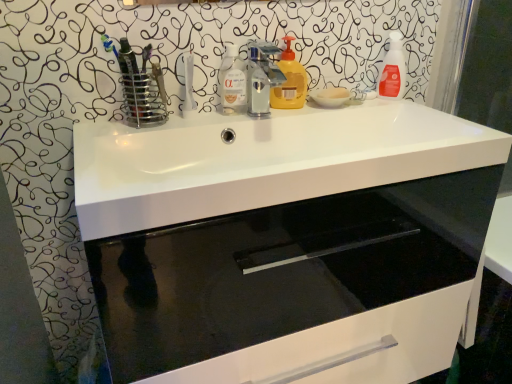
Question: Is white glossy sink at center wider than translucent orange spray bottle at upper right, acting as the 3th cleaning product starting from the left?

Choices:
 (A) yes
 (B) no

Answer: (A)

Question: Does white glossy sink at center contain translucent orange spray bottle at upper right, acting as the 3th cleaning product starting from the left?

Choices:
 (A) no
 (B) yes

Answer: (A)

Question: From the image's perspective, does white glossy sink at center appear higher than translucent orange spray bottle at upper right, acting as the 3th cleaning product starting from the left?

Choices:
 (A) yes
 (B) no

Answer: (B)

Question: Could you tell me if white glossy sink at center is turned towards translucent orange spray bottle at upper right, which is counted as the first cleaning product, starting from the right?

Choices:
 (A) no
 (B) yes

Answer: (A)

Question: Is white glossy sink at center thinner than translucent orange spray bottle at upper right, acting as the 3th cleaning product starting from the left?

Choices:
 (A) yes
 (B) no

Answer: (B)

Question: Which is correct: translucent orange spray bottle at upper right, which is counted as the first cleaning product, starting from the right, is inside transparent liquid at center, the third cleaning product when ordered from right to left, or outside of it?

Choices:
 (A) outside
 (B) inside

Answer: (A)

Question: Does point (393, 82) appear closer or farther from the camera than point (240, 71)?

Choices:
 (A) closer
 (B) farther

Answer: (B)

Question: In the image, is translucent orange spray bottle at upper right, which is counted as the first cleaning product, starting from the right, positioned in front of or behind transparent liquid at center, positioned as the first cleaning product in left-to-right order?

Choices:
 (A) behind
 (B) front

Answer: (A)

Question: From a real-world perspective, is translucent orange spray bottle at upper right, acting as the 3th cleaning product starting from the left, positioned above or below transparent liquid at center, the third cleaning product when ordered from right to left?

Choices:
 (A) above
 (B) below

Answer: (A)

Question: Visually, is white glossy sink at center positioned to the left or to the right of translucent orange spray bottle at upper right, acting as the 3th cleaning product starting from the left?

Choices:
 (A) right
 (B) left

Answer: (B)

Question: From the image's perspective, is white glossy sink at center located above or below translucent orange spray bottle at upper right, which is counted as the first cleaning product, starting from the right?

Choices:
 (A) below
 (B) above

Answer: (A)

Question: Looking at their shapes, would you say white glossy sink at center is wider or thinner than translucent orange spray bottle at upper right, acting as the 3th cleaning product starting from the left?

Choices:
 (A) thin
 (B) wide

Answer: (B)

Question: Considering the positions of point (414, 135) and point (400, 59), is point (414, 135) closer or farther from the camera than point (400, 59)?

Choices:
 (A) closer
 (B) farther

Answer: (A)

Question: From the image's perspective, is white glossy sink at center located above or below transparent liquid at center, positioned as the first cleaning product in left-to-right order?

Choices:
 (A) above
 (B) below

Answer: (B)

Question: Considering the positions of white glossy sink at center and transparent liquid at center, positioned as the first cleaning product in left-to-right order, in the image, is white glossy sink at center taller or shorter than transparent liquid at center, positioned as the first cleaning product in left-to-right order,?

Choices:
 (A) short
 (B) tall

Answer: (A)